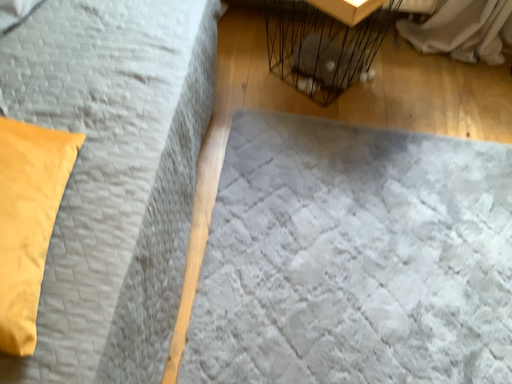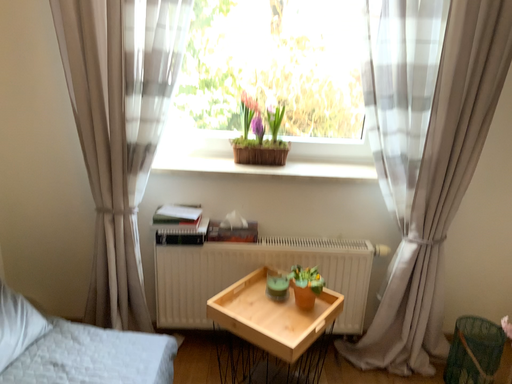
Question: Which way did the camera rotate in the video?

Choices:
 (A) rotated downward
 (B) rotated upward

Answer: (B)